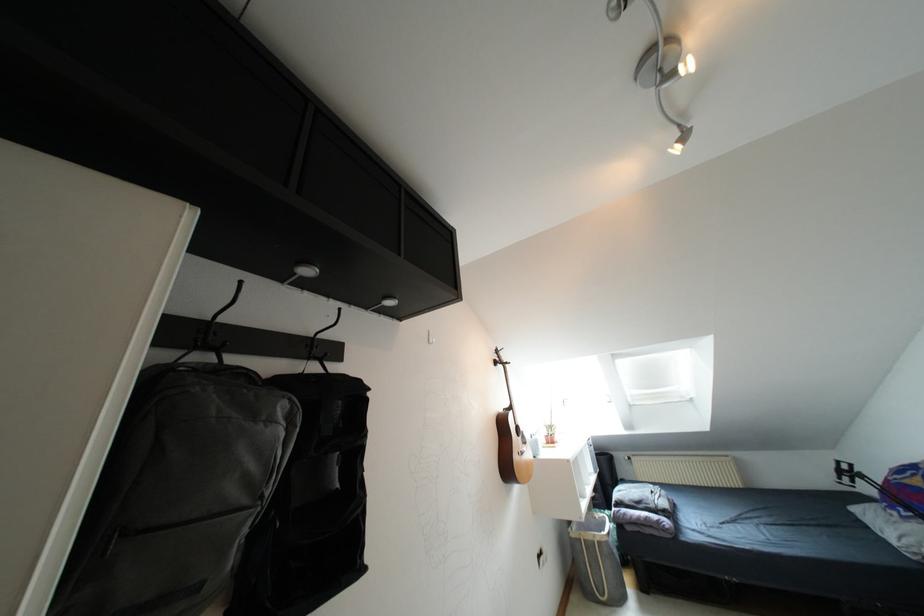
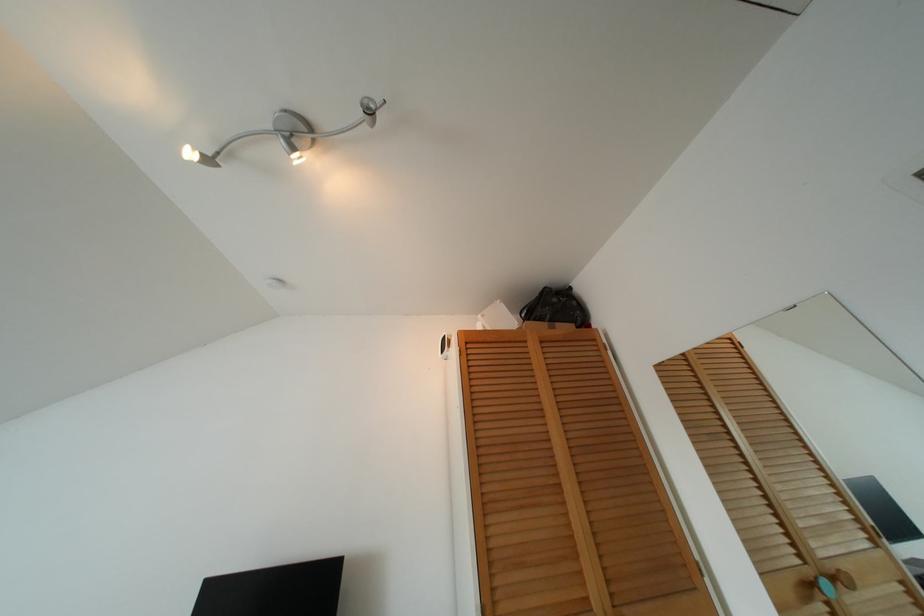
In the second image, find the point that corresponds to (683,138) in the first image.

(208, 160)